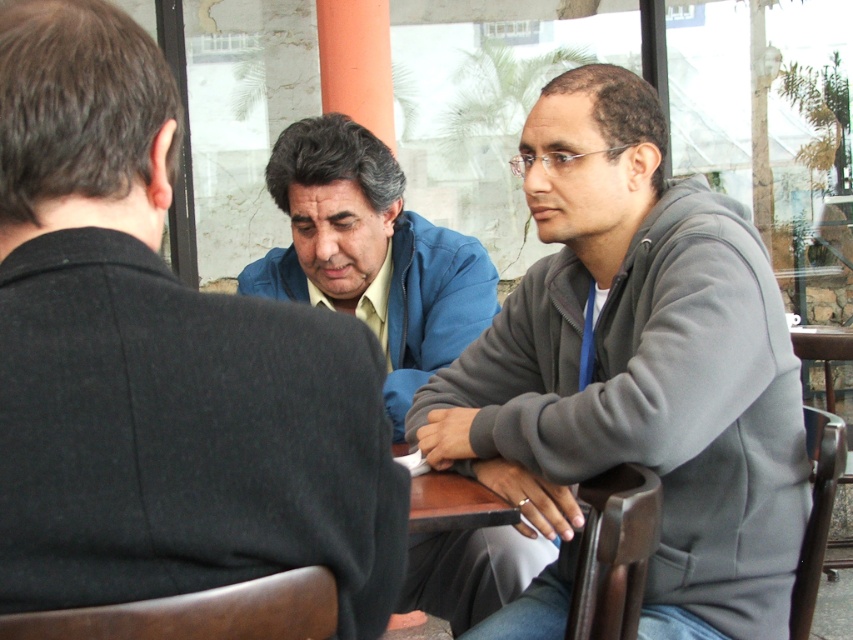
You are a photographer trying to capture a closeup of the gray fleece jacket at center without including the brown wooden table at center in the shot. Based on their positions, is this possible?

The gray fleece jacket at center is positioned on the right side of brown wooden table at center, so it is possible to capture a closeup of the gray fleece jacket at center without including the brown wooden table at center by framing the shot to the right side of the table.

You are a photographer trying to capture a shot of the gray fleece jacket at center and the brown wooden table at center. Which object is taller?

The gray fleece jacket at center is taller than the brown wooden table at center.

You are a delivery person carrying a box that is 20 inches wide. You need to place it between the blue matte jacket at center and the brown wooden table at center. Is there enough space?

The blue matte jacket at center and brown wooden table at center are 19.22 inches apart from each other, so there is not enough space to place a box that is 20 inches wide between them.